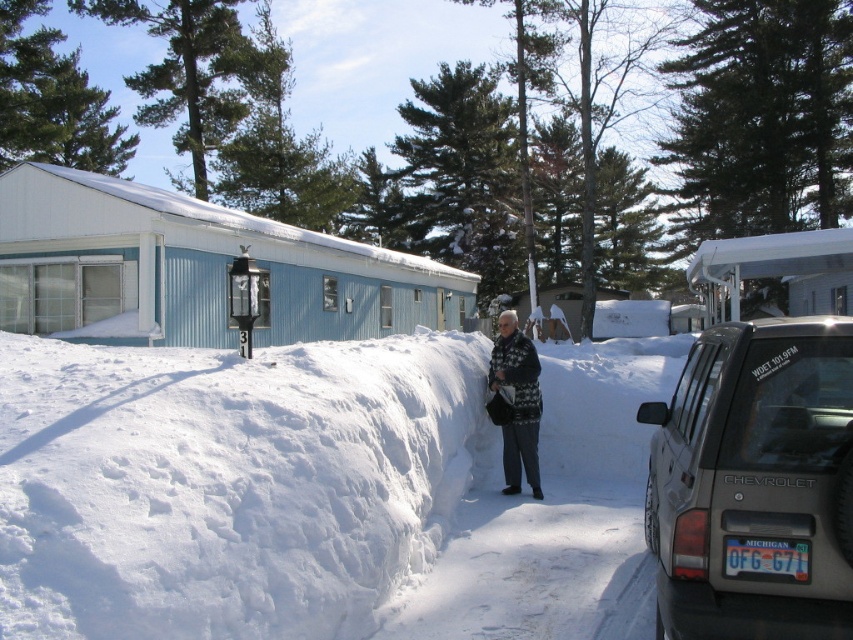
Which is in front, point (746, 550) or point (515, 324)?

Point (746, 550) is more forward.

Is metallic gray suv at right to the left of white knitted sweater at center from the viewer's perspective?

No, metallic gray suv at right is not to the left of white knitted sweater at center.

The height and width of the screenshot is (640, 853). In order to click on metallic gray suv at right in this screenshot , I will do `click(753, 484)`.

Can you confirm if white corrugated metal hut at center is positioned to the left of wooden cabin at center?

Yes, white corrugated metal hut at center is to the left of wooden cabin at center.

Describe the element at coordinates (195, 269) in the screenshot. The image size is (853, 640). I see `white corrugated metal hut at center` at that location.

Image resolution: width=853 pixels, height=640 pixels. What are the coordinates of `white corrugated metal hut at center` in the screenshot? It's located at (195, 269).

Does white fluffy snow at center have a smaller size compared to white knitted sweater at center?

No.

Who is taller, white fluffy snow at center or white knitted sweater at center?

white knitted sweater at center is taller.

Is point (355, 557) less distant than point (524, 436)?

Yes, point (355, 557) is in front of point (524, 436).

Image resolution: width=853 pixels, height=640 pixels. In order to click on white fluffy snow at center in this screenshot , I will do `click(225, 483)`.